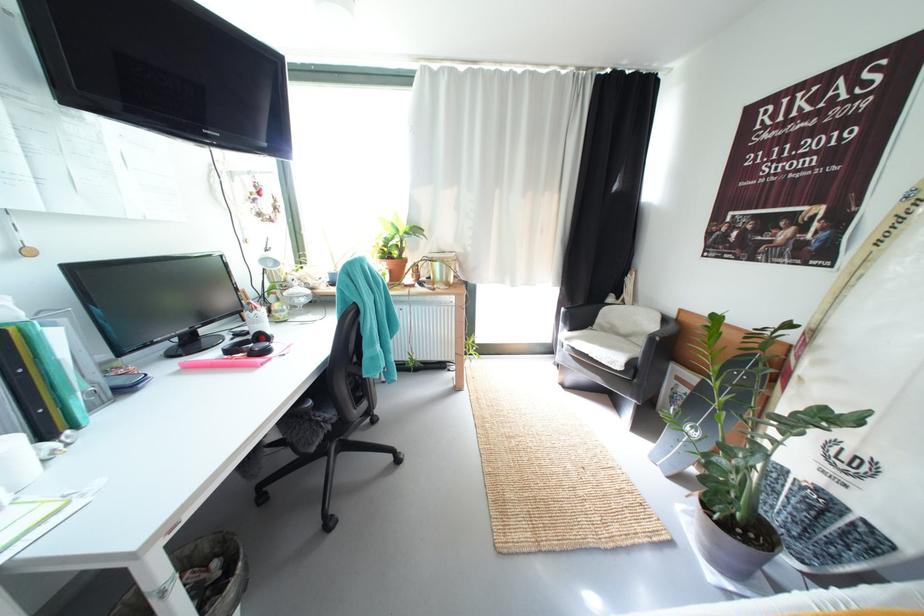
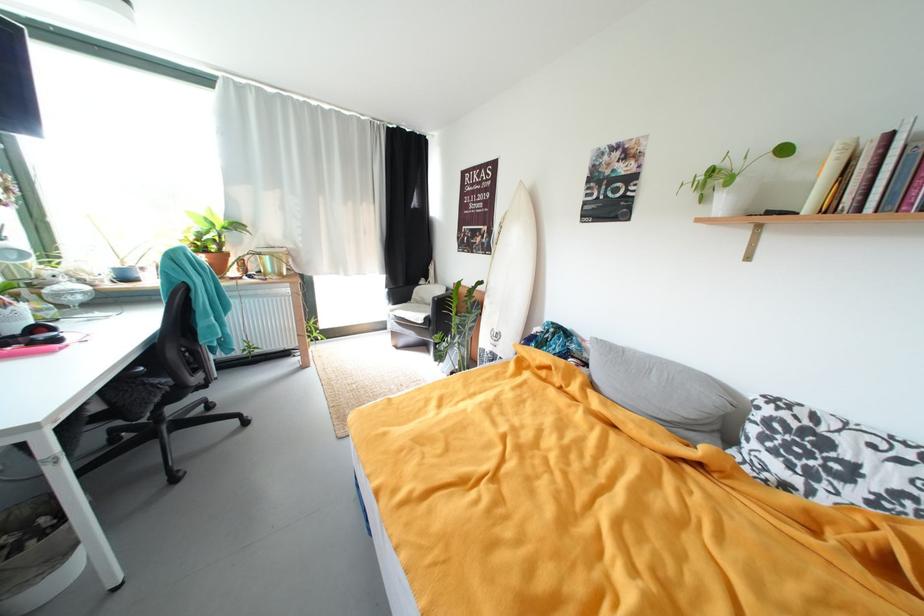
The point at (406, 232) is marked in the first image. Where is the corresponding point in the second image?

(221, 225)